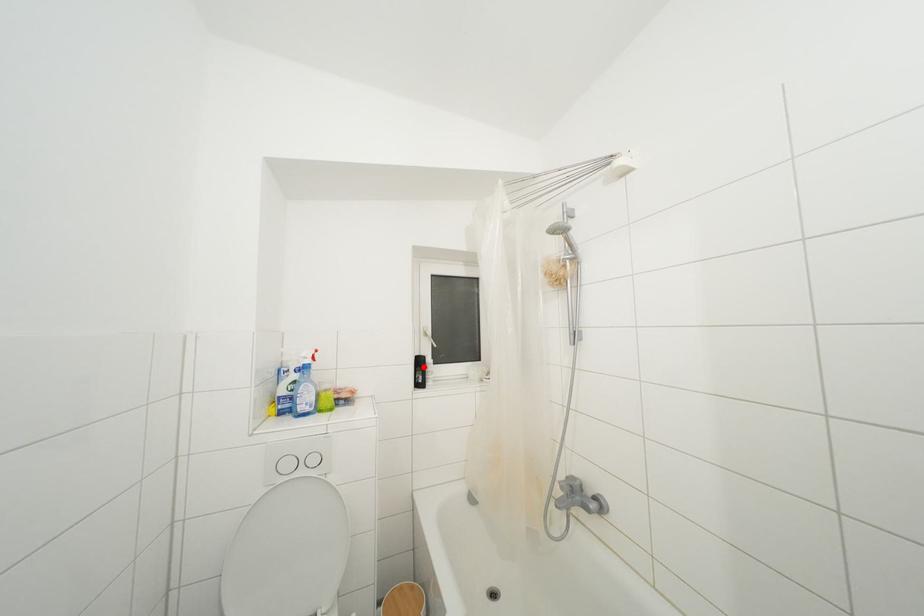
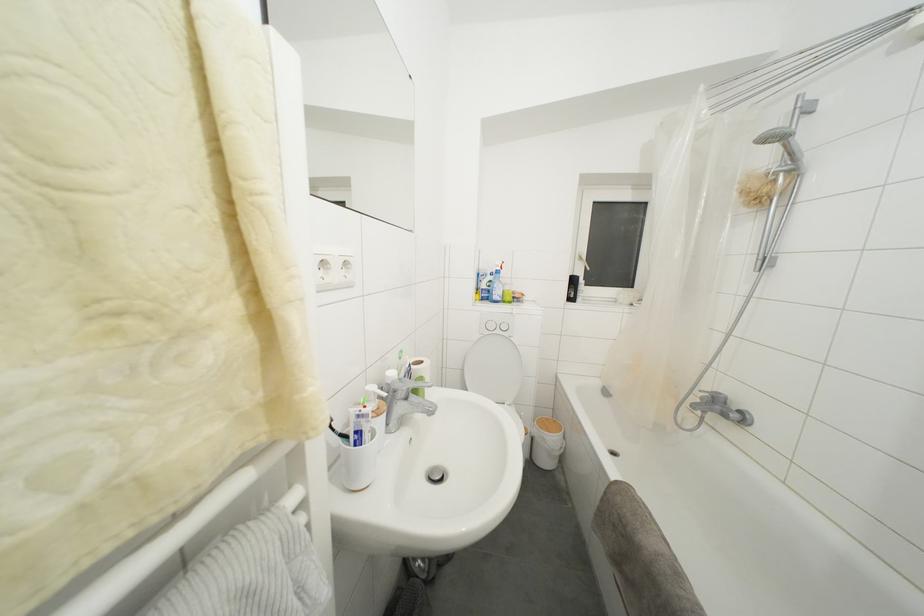
Question: I am providing you with two images of the same scene from different viewpoints. Image1 has a red point marked. In image2, the corresponding 3D location appears at what relative position? Reply with the corresponding letter.

Choices:
 (A) Closer
 (B) Farther

Answer: (A)